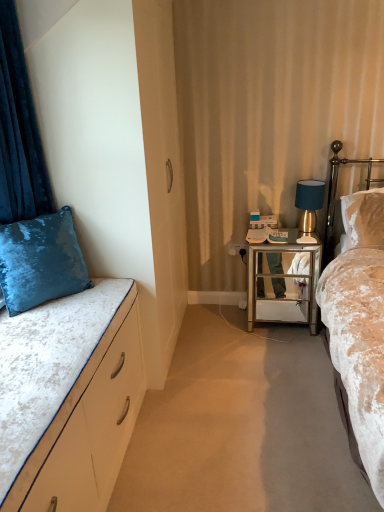
Looking at this image, what is the approximate width of white glossy power outlet at center?

It is 0.55 inches.

Locate an element on the screen. This screenshot has width=384, height=512. velvet white bed at left, the second bed viewed from the right is located at coordinates (69, 398).

What do you see at coordinates (19, 131) in the screenshot? I see `velvet blue curtain at left` at bounding box center [19, 131].

What do you see at coordinates (359, 331) in the screenshot? I see `velvet beige bed at right, which appears as the 1th bed when viewed from the right` at bounding box center [359, 331].

In order to face velvet blue pillow at left, should I rotate leftwards or rightwards?

Rotate left and turn 19.263 degrees.

I want to click on white glossy power outlet at center, so click(x=237, y=249).

How much distance is there between velvet white bed at left, the first bed viewed from the left, and blue velvet lamp at upper right?

They are 5.37 feet apart.

Who is shorter, velvet white bed at left, the second bed viewed from the right, or blue velvet lamp at upper right?

Standing shorter between the two is velvet white bed at left, the second bed viewed from the right.

From the image's perspective, who appears lower, velvet white bed at left, the second bed viewed from the right, or blue velvet lamp at upper right?

velvet white bed at left, the second bed viewed from the right, is shown below in the image.

Consider the image. Is velvet white bed at left, the second bed viewed from the right, far away from blue velvet lamp at upper right?

Yes, velvet white bed at left, the second bed viewed from the right, is far from blue velvet lamp at upper right.

From a real-world perspective, is gold mirrored nightstand at right over blue velvet lamp at upper right?

No, from a real-world perspective, gold mirrored nightstand at right is not above blue velvet lamp at upper right.

How much distance is there between gold mirrored nightstand at right and blue velvet lamp at upper right?

A distance of 34.39 centimeters exists between gold mirrored nightstand at right and blue velvet lamp at upper right.

Consider the image. Choose the correct answer: Is gold mirrored nightstand at right inside blue velvet lamp at upper right or outside it?

gold mirrored nightstand at right is located beyond the bounds of blue velvet lamp at upper right.

Can you confirm if gold mirrored nightstand at right is smaller than blue velvet lamp at upper right?

Actually, gold mirrored nightstand at right might be larger than blue velvet lamp at upper right.

From the image's perspective, is gold mirrored nightstand at right located above or below velvet white bed at left, the first bed viewed from the left?

Clearly, from the image's perspective, gold mirrored nightstand at right is above velvet white bed at left, the first bed viewed from the left.

Which is correct: gold mirrored nightstand at right is inside velvet white bed at left, the second bed viewed from the right, or outside of it?

gold mirrored nightstand at right exists outside the volume of velvet white bed at left, the second bed viewed from the right.

Considering the relative sizes of gold mirrored nightstand at right and velvet white bed at left, the second bed viewed from the right, in the image provided, is gold mirrored nightstand at right bigger than velvet white bed at left, the second bed viewed from the right,?

Yes, gold mirrored nightstand at right is bigger than velvet white bed at left, the second bed viewed from the right.

Measure the distance from gold mirrored nightstand at right to velvet white bed at left, the first bed viewed from the left.

They are 1.34 meters apart.

Are gold mirrored nightstand at right and velvet blue pillow at left beside each other?

No, gold mirrored nightstand at right is not making contact with velvet blue pillow at left.

From the image's perspective, which is below, gold mirrored nightstand at right or velvet blue pillow at left?

gold mirrored nightstand at right appears lower in the image.

From a real-world perspective, relative to velvet blue pillow at left, is gold mirrored nightstand at right vertically above or below?

gold mirrored nightstand at right is situated lower than velvet blue pillow at left in the real world.

From a real-world perspective, is gold metallic headboard at right physically located above or below white glossy power outlet at center?

gold metallic headboard at right is situated higher than white glossy power outlet at center in the real world.

In terms of height, does gold metallic headboard at right look taller or shorter compared to white glossy power outlet at center?

Clearly, gold metallic headboard at right is taller compared to white glossy power outlet at center.

Which point is more distant from viewer, (331, 143) or (232, 246)?

Positioned behind is point (232, 246).

Considering the sizes of objects velvet blue pillow at left and velvet beige bed at right, which appears as the 1th bed when viewed from the right, in the image provided, who is thinner, velvet blue pillow at left or velvet beige bed at right, which appears as the 1th bed when viewed from the right,?

velvet blue pillow at left is thinner.

From a real-world perspective, who is located lower, velvet blue pillow at left or velvet beige bed at right, which appears as the 1th bed when viewed from the right?

velvet beige bed at right, which appears as the 1th bed when viewed from the right, from a real-world perspective.

Where is `the 2nd bed to the right when counting from the velvet blue pillow at left`? This screenshot has width=384, height=512. the 2nd bed to the right when counting from the velvet blue pillow at left is located at coordinates (359, 331).

Considering the positions of objects velvet blue pillow at left and velvet beige bed at right, the 2th bed when ordered from left to right, in the image provided, who is more to the left, velvet blue pillow at left or velvet beige bed at right, the 2th bed when ordered from left to right,?

Positioned to the left is velvet blue pillow at left.

At what (x,y) coordinates should I click in order to perform the action: click on the 1st bed positioned below the blue velvet lamp at upper right (from the image's perspective). Please return your answer as a coordinate pair (x, y). This screenshot has height=512, width=384. Looking at the image, I should click on (359, 331).

From a real-world perspective, between velvet beige bed at right, which appears as the 1th bed when viewed from the right, and blue velvet lamp at upper right, who is vertically higher?

blue velvet lamp at upper right is physically above.

Is velvet beige bed at right, the 2th bed when ordered from left to right, bigger than blue velvet lamp at upper right?

Correct, velvet beige bed at right, the 2th bed when ordered from left to right, is larger in size than blue velvet lamp at upper right.

Is velvet beige bed at right, which appears as the 1th bed when viewed from the right, situated inside blue velvet lamp at upper right or outside?

velvet beige bed at right, which appears as the 1th bed when viewed from the right, is not enclosed by blue velvet lamp at upper right.

Where is `lamp that appears on the right of velvet white bed at left, the second bed viewed from the right`? lamp that appears on the right of velvet white bed at left, the second bed viewed from the right is located at coordinates (309, 206).

Locate an element on the screen. The image size is (384, 512). lamp above the gold mirrored nightstand at right (from a real-world perspective) is located at coordinates (309, 206).

Considering their positions, is gold metallic headboard at right positioned further to white glossy power outlet at center than velvet blue pillow at left?

velvet blue pillow at left is positioned further to the anchor white glossy power outlet at center.

Based on the photo, looking at the image, which one is located further to velvet blue curtain at left, gold mirrored nightstand at right or gold metallic headboard at right?

Among the two, gold metallic headboard at right is located further to velvet blue curtain at left.

When comparing their distances from velvet blue pillow at left, does gold metallic headboard at right or velvet beige bed at right, the 2th bed when ordered from left to right, seem further?

gold metallic headboard at right lies further to velvet blue pillow at left than the other object.

Looking at the image, which one is located further to velvet blue curtain at left, gold metallic headboard at right or velvet white bed at left, the first bed viewed from the left?

gold metallic headboard at right.

When comparing their distances from blue velvet lamp at upper right, does velvet white bed at left, the second bed viewed from the right, or velvet blue pillow at left seem closer?

The object closer to blue velvet lamp at upper right is velvet blue pillow at left.

Looking at the image, which one is located further to blue velvet lamp at upper right, gold mirrored nightstand at right or velvet blue pillow at left?

velvet blue pillow at left lies further to blue velvet lamp at upper right than the other object.

From the image, which object appears to be farther from velvet blue pillow at left, velvet beige bed at right, which appears as the 1th bed when viewed from the right, or gold mirrored nightstand at right?

velvet beige bed at right, which appears as the 1th bed when viewed from the right.

Considering their positions, is blue velvet lamp at upper right positioned closer to velvet blue curtain at left than velvet blue pillow at left?

The object closer to velvet blue curtain at left is velvet blue pillow at left.

Where is `desk positioned between velvet blue pillow at left and white glossy power outlet at center from near to far`? desk positioned between velvet blue pillow at left and white glossy power outlet at center from near to far is located at coordinates (286, 282).

Identify the location of headboard located between velvet beige bed at right, which appears as the 1th bed when viewed from the right, and gold mirrored nightstand at right in the depth direction. (336, 191).

Identify the location of lamp situated between velvet blue curtain at left and gold metallic headboard at right from left to right. The width and height of the screenshot is (384, 512). click(309, 206).

At what (x,y) coordinates should I click in order to perform the action: click on pillow between velvet blue curtain at left and blue velvet lamp at upper right. Please return your answer as a coordinate pair (x, y). The height and width of the screenshot is (512, 384). Looking at the image, I should click on (40, 261).